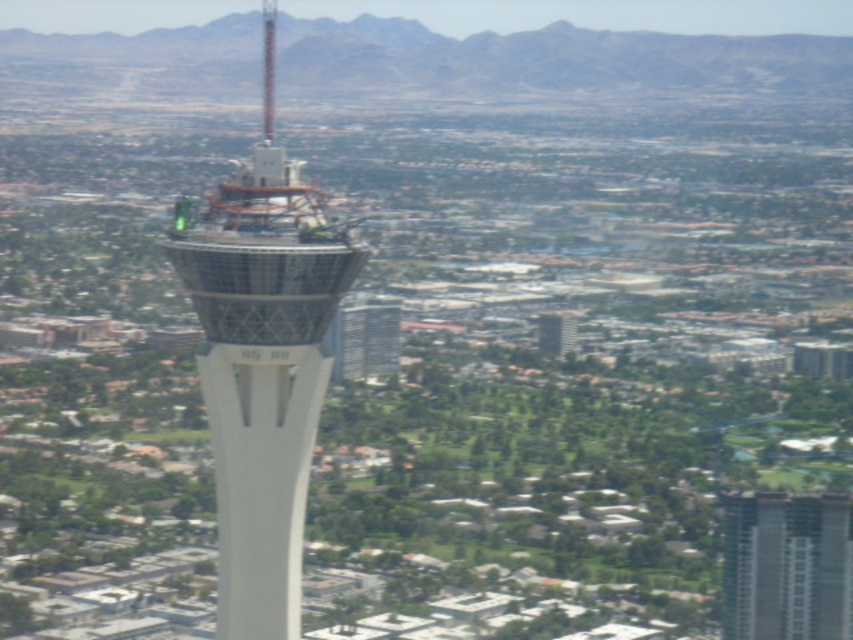
Does white glass tower at center have a smaller size compared to gray concrete building at center?

Actually, white glass tower at center might be larger than gray concrete building at center.

Is white glass tower at center behind gray concrete building at center?

No, white glass tower at center is in front of gray concrete building at center.

Does point (236, 284) come behind point (753, 625)?

No, (236, 284) is in front of (753, 625).

Identify the location of white glass tower at center. This screenshot has height=640, width=853. (263, 364).